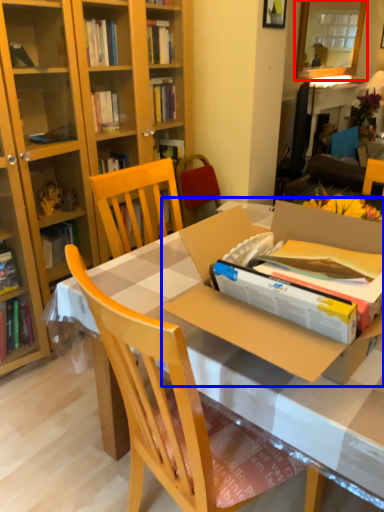
Question: Which object is closer to the camera taking this photo, mirror (highlighted by a red box) or cardboard box (highlighted by a blue box)?

Choices:
 (A) mirror
 (B) cardboard box

Answer: (B)